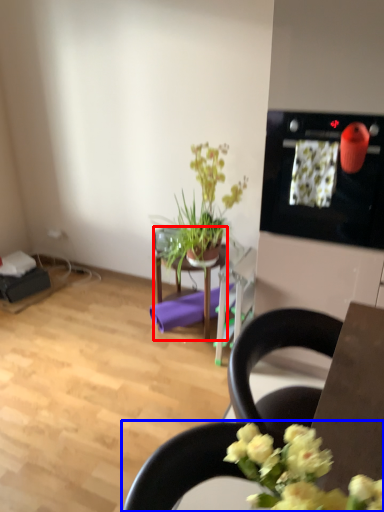
Question: Among these objects, which one is farthest to the camera, table (highlighted by a red box) or chair (highlighted by a blue box)?

Choices:
 (A) table
 (B) chair

Answer: (A)